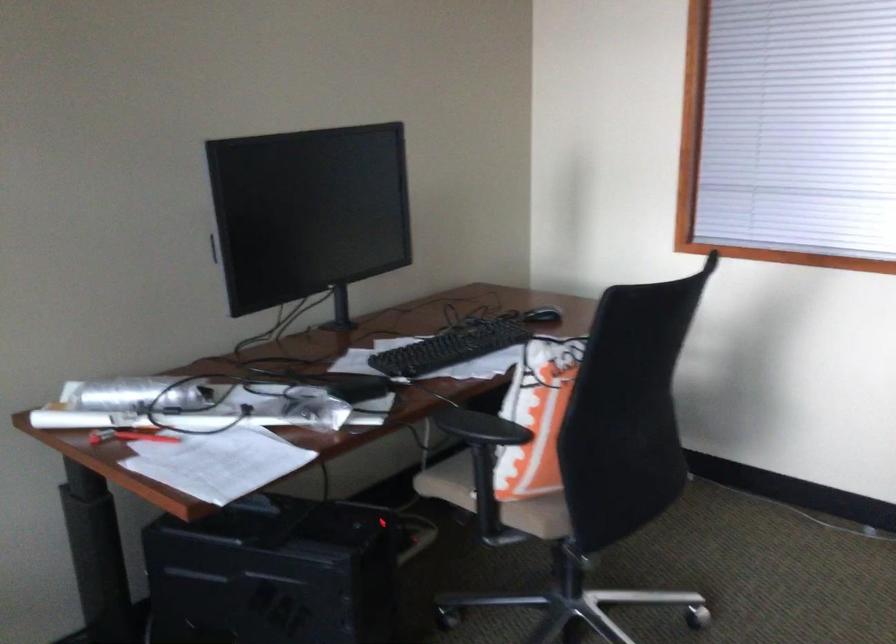
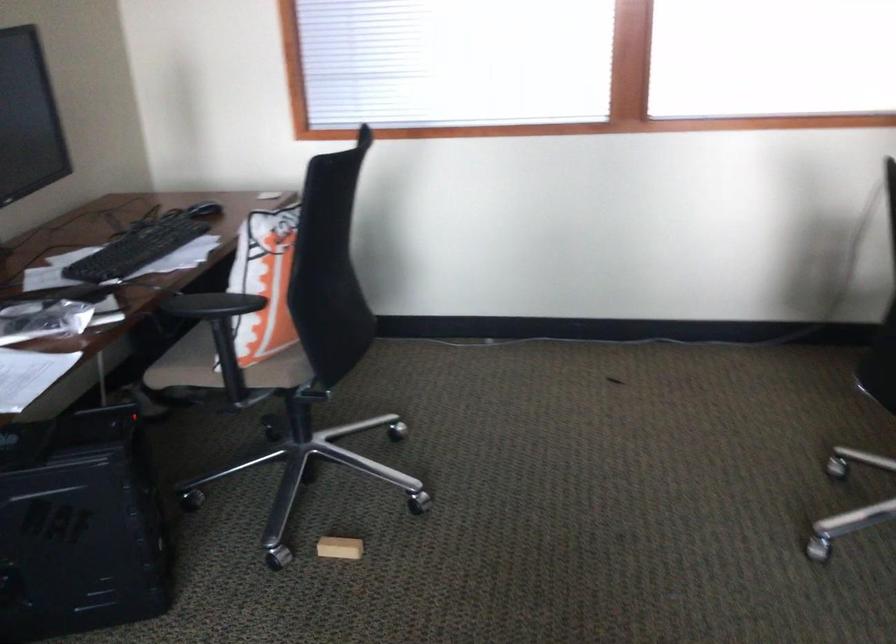
Locate, in the second image, the point that corresponds to (536,315) in the first image.

(204, 210)